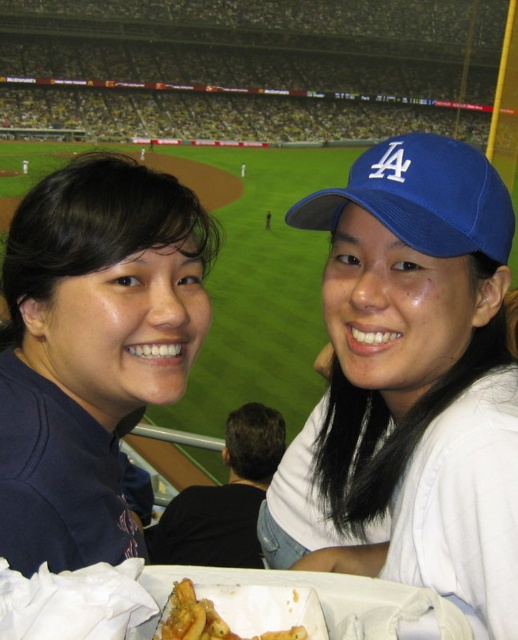
Question: Which point appears farthest from the camera in this image?

Choices:
 (A) (184, 634)
 (B) (80, 481)
 (C) (381, 547)

Answer: (C)

Question: Is blue fabric cap at upper right thinner than golden crispy fries at lower center?

Choices:
 (A) no
 (B) yes

Answer: (A)

Question: Which point is closer to the camera?

Choices:
 (A) (6, 266)
 (B) (289, 464)

Answer: (A)

Question: Is matte blue baseball cap at upper right to the right of blue fabric baseball cap at upper right from the viewer's perspective?

Choices:
 (A) yes
 (B) no

Answer: (B)

Question: Estimate the real-world distances between objects in this image. Which object is farther from the blue fabric baseball cap at upper right?

Choices:
 (A) golden crispy fries at lower center
 (B) blue fabric cap at upper right
 (C) matte blue baseball cap at upper right

Answer: (A)

Question: Can you confirm if blue fabric cap at upper right is thinner than golden crispy fries at lower center?

Choices:
 (A) no
 (B) yes

Answer: (A)